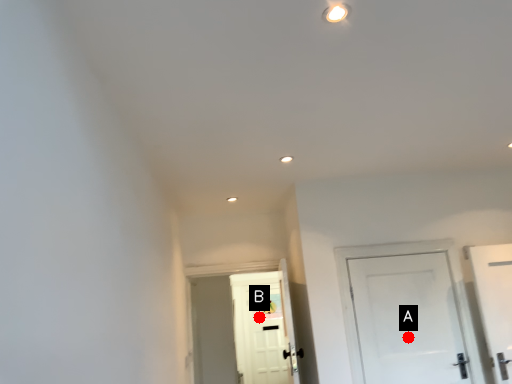
Question: Two points are circled on the image, labeled by A and B beside each circle. Which point appears closest to the camera in this image?

Choices:
 (A) A is closer
 (B) B is closer

Answer: (A)